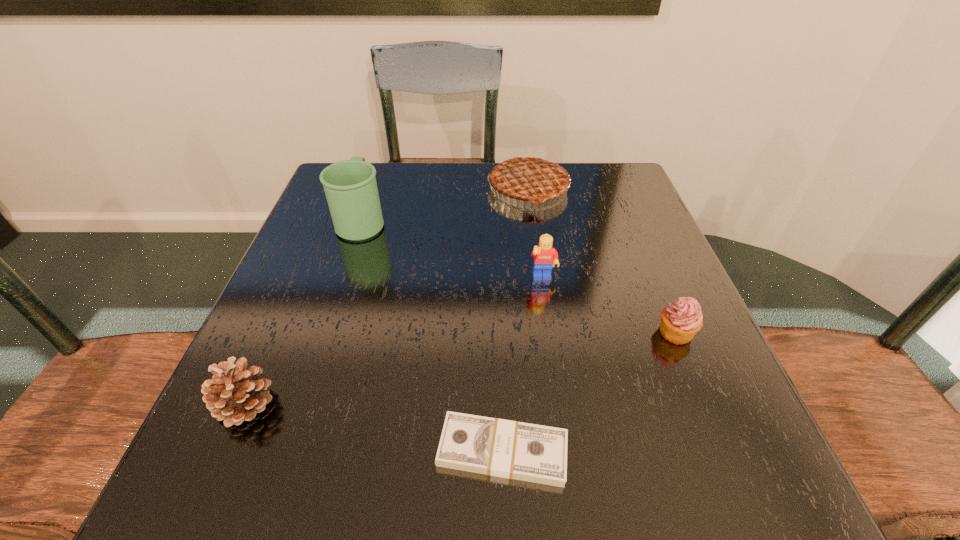
I want to click on object that is at the right edge, so click(681, 320).

Where is `object that is at the far left corner`? object that is at the far left corner is located at coordinates (350, 186).

Find the location of a particular element. The width and height of the screenshot is (960, 540). vacant space at the far edge of the desktop is located at coordinates (456, 178).

Where is `vacant space at the near edge`? vacant space at the near edge is located at coordinates (646, 458).

Locate an element on the screen. The image size is (960, 540). blank space at the left edge of the desktop is located at coordinates (273, 293).

Locate an element on the screen. This screenshot has height=540, width=960. vacant space at the right edge of the desktop is located at coordinates (594, 251).

Image resolution: width=960 pixels, height=540 pixels. I want to click on free region at the far left corner of the desktop, so click(387, 170).

Image resolution: width=960 pixels, height=540 pixels. Identify the location of vacant space at the near left corner of the desktop. (198, 448).

The height and width of the screenshot is (540, 960). I want to click on blank space at the far right corner, so click(604, 202).

Where is `free spot at the near right corner of the desktop`? Image resolution: width=960 pixels, height=540 pixels. free spot at the near right corner of the desktop is located at coordinates (750, 484).